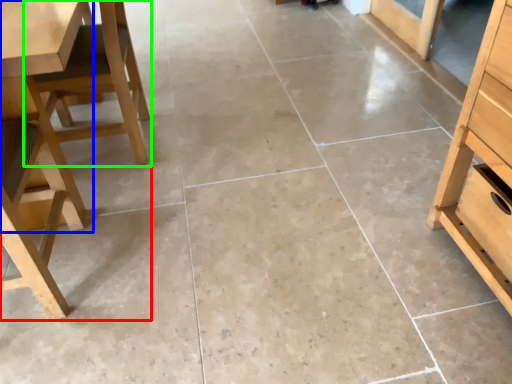
Question: Which object is the farthest from chair (highlighted by a red box)? Choose among these: table (highlighted by a blue box) or chair (highlighted by a green box).

Choices:
 (A) table
 (B) chair

Answer: (A)